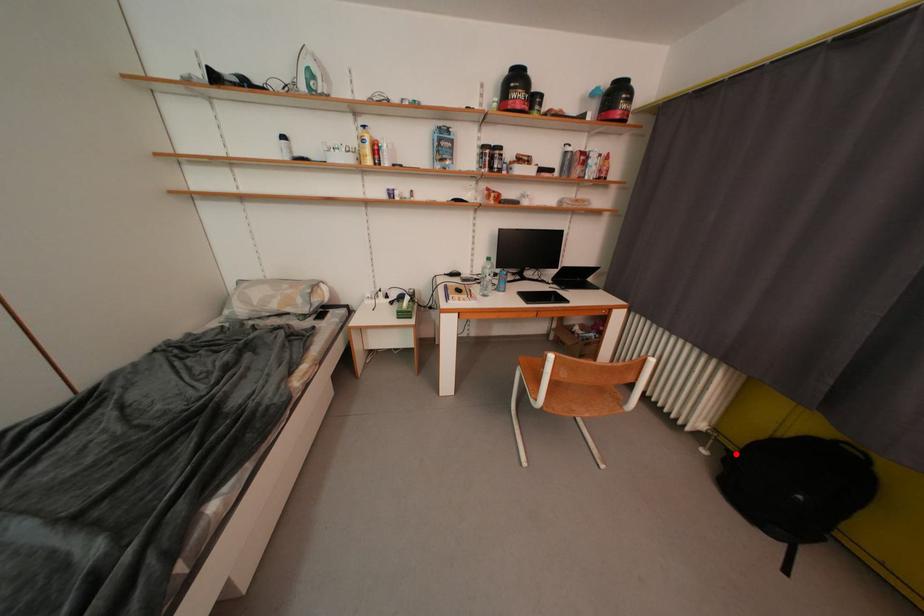
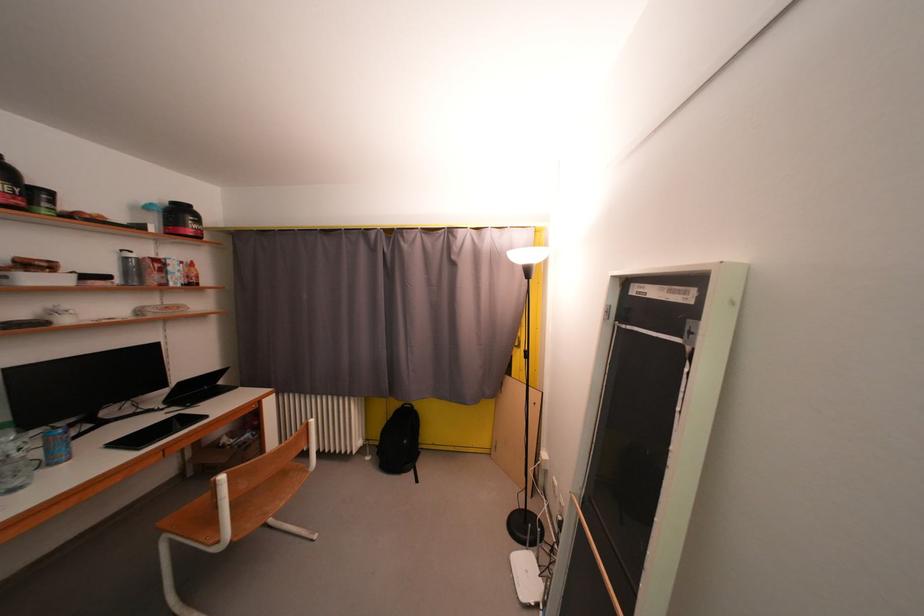
Question: I am providing you with two images of the same scene from different viewpoints. A red point is shown in image1. For the corresponding object point in image2, is it positioned nearer or farther from the camera?

Choices:
 (A) Nearer
 (B) Farther

Answer: (B)